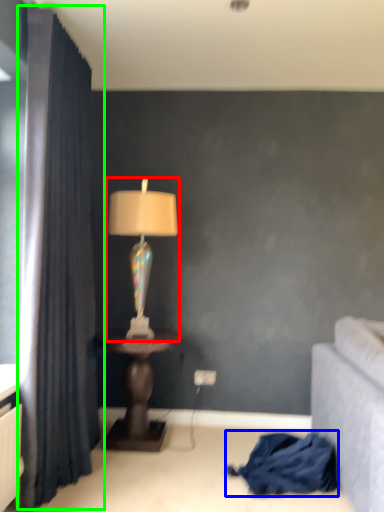
Question: Which is farther away from lamp (highlighted by a red box)? blanket (highlighted by a blue box) or curtain (highlighted by a green box)?

Choices:
 (A) blanket
 (B) curtain

Answer: (A)